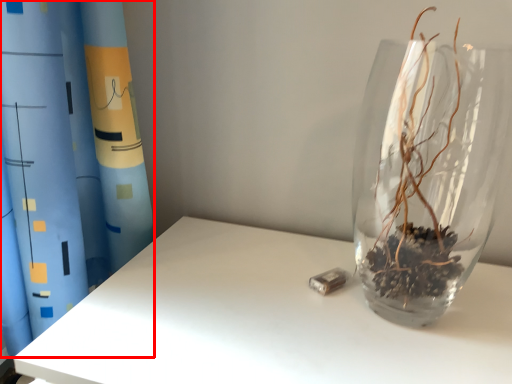
Question: From the image's perspective, what is the correct spatial relationship of curtain (annotated by the red box) in relation to vase?

Choices:
 (A) below
 (B) above

Answer: (B)